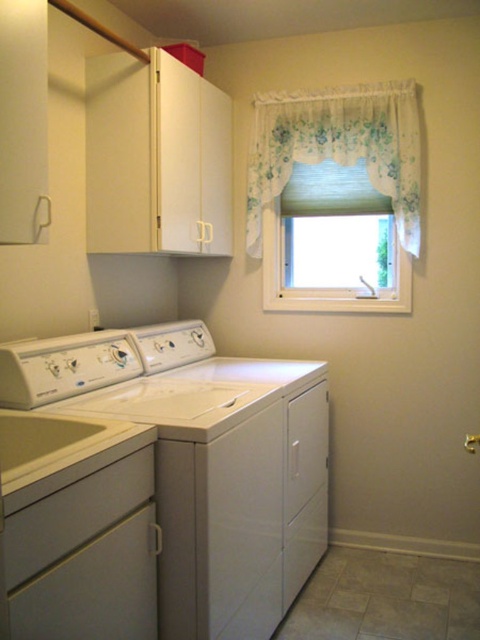
This screenshot has height=640, width=480. What do you see at coordinates (184, 460) in the screenshot? I see `white glossy washing machine at lower left` at bounding box center [184, 460].

Between white glossy washing machine at lower left and white matte washing machine at center, which one is positioned higher?

white glossy washing machine at lower left is above.

Which is in front, point (183, 387) or point (300, 362)?

Point (183, 387) is more forward.

Where is `white glossy washing machine at lower left`? The height and width of the screenshot is (640, 480). white glossy washing machine at lower left is located at coordinates [184, 460].

Identify the location of floral lace curtain at upper center. The image size is (480, 640). (338, 147).

Is the position of floral lace curtain at upper center more distant than that of white glossy sink at lower left?

Yes, floral lace curtain at upper center is further from the viewer.

Identify the location of floral lace curtain at upper center. (338, 147).

Which of these two, white glossy washing machine at lower left or white glossy sink at lower left, stands shorter?

white glossy sink at lower left is shorter.

Does point (167, 368) lie in front of point (32, 461)?

That is False.

Which is in front, point (110, 372) or point (40, 465)?

Point (40, 465) is more forward.

Where is `white glossy washing machine at lower left`? The image size is (480, 640). white glossy washing machine at lower left is located at coordinates (184, 460).